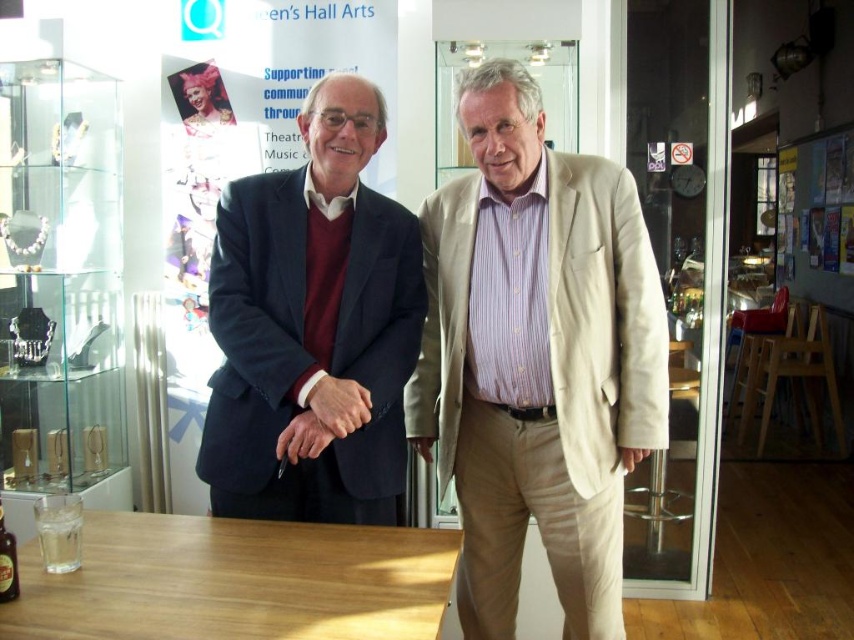
You are a photographer setting up a shoot in the scene described. You need to ensure that the beige cotton suit at center is visible in the frame without being blocked by the clear glass bottle at lower left. Based on their positions, is this possible?

The beige cotton suit at center is above the clear glass bottle at lower left, so it will not be blocked by the bottle and should be fully visible in the frame.

Based on the photo, you are standing at the origin point in the image. Which of the two points, point (168, 529) or point (0, 596), is located further away from you?

Point (168, 529) is behind point (0, 596), so it is further away from you.